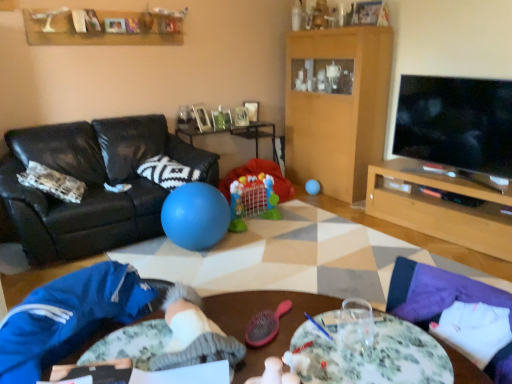
Where is `free space above white knitted pillow at center (from a real-world perspective)`? The height and width of the screenshot is (384, 512). free space above white knitted pillow at center (from a real-world perspective) is located at coordinates (172, 163).